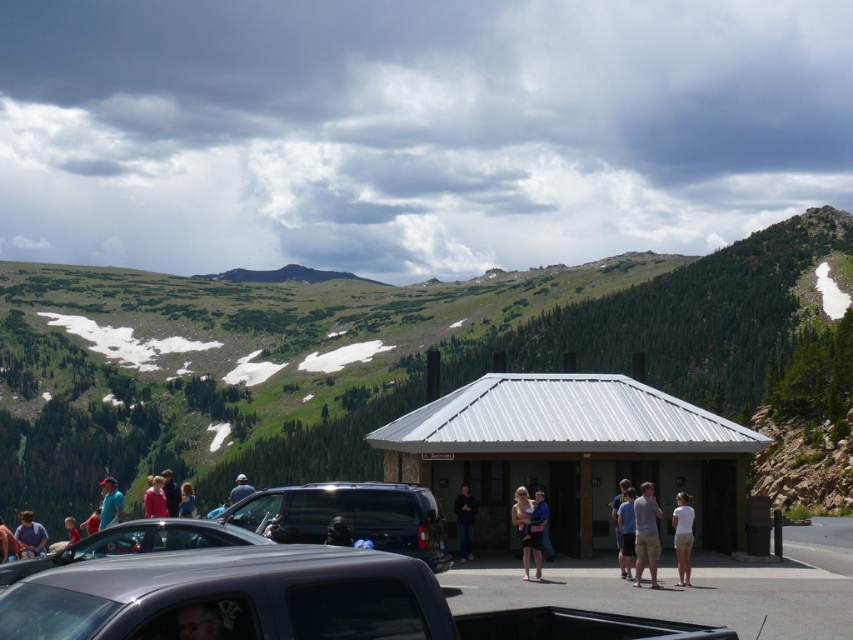
Is dark gray asphalt parking lot at center taller than blue denim shirt at center?

Incorrect, dark gray asphalt parking lot at center's height is not larger of blue denim shirt at center's.

Is dark gray asphalt parking lot at center above blue denim shirt at center?

Correct, dark gray asphalt parking lot at center is located above blue denim shirt at center.

Measure the distance between dark gray asphalt parking lot at center and camera.

dark gray asphalt parking lot at center is 102.49 feet away from camera.

The width and height of the screenshot is (853, 640). In order to click on dark gray asphalt parking lot at center in this screenshot , I will do `click(691, 588)`.

Can you confirm if tan cotton shorts at center is smaller than dark blue shirt at center?

Actually, tan cotton shorts at center might be larger than dark blue shirt at center.

Is point (643, 532) positioned behind point (462, 554)?

No, (643, 532) is closer to viewer.

Is point (648, 540) in front of point (465, 525)?

Yes, point (648, 540) is closer to viewer.

This screenshot has width=853, height=640. What are the coordinates of `tan cotton shorts at center` in the screenshot? It's located at (x=646, y=532).

Can you confirm if dark gray asphalt parking lot at center is bigger than denim jacket at lower left?

No, dark gray asphalt parking lot at center is not bigger than denim jacket at lower left.

Between point (531, 586) and point (16, 534), which one is positioned in front?

Point (531, 586)

This screenshot has height=640, width=853. Find the location of `dark gray asphalt parking lot at center`. dark gray asphalt parking lot at center is located at coordinates (691, 588).